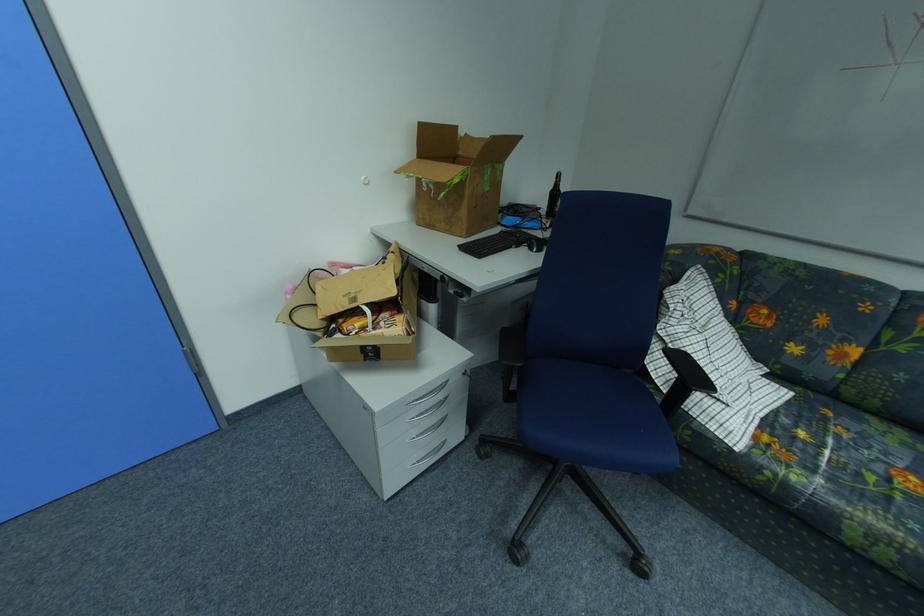
Find where to sit the blue chair sitting surface. Please return your answer as a coordinate pair (x, y).

(586, 403)